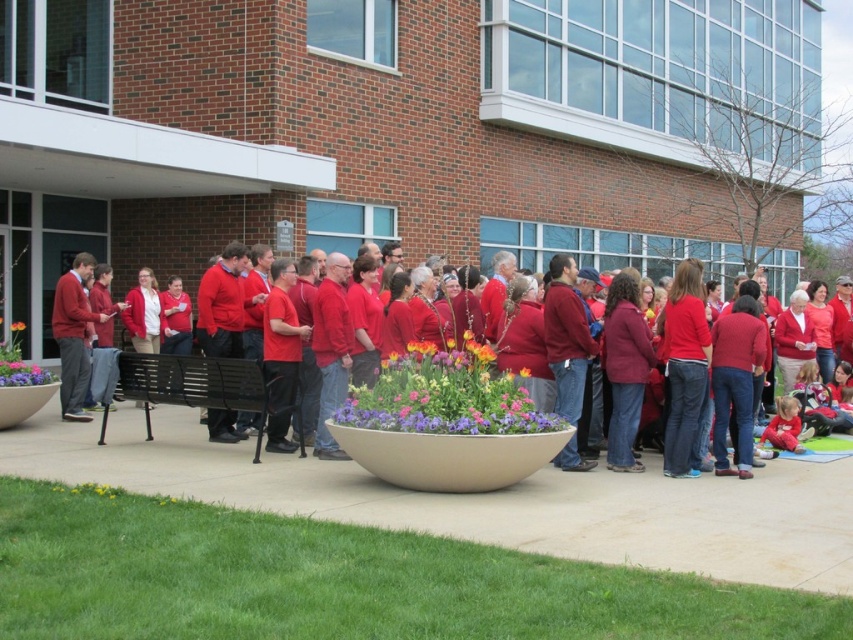
Question: Estimate the real-world distances between objects in this image. Which object is farther from the orange matte flower at center?

Choices:
 (A) matte red sweater at left
 (B) matte ceramic pot at lower left
 (C) black metal bench at lower left
 (D) matte red sweater at center

Answer: (D)

Question: Can you confirm if matte red sweater at center is positioned above orange matte flower at center?

Choices:
 (A) yes
 (B) no

Answer: (A)

Question: Estimate the real-world distances between objects in this image. Which object is farther from the vibrant floral bouquet at center?

Choices:
 (A) matte red sweater at left
 (B) matte red sweater at center
 (C) matte ceramic pot at lower left
 (D) orange matte flower at center

Answer: (D)

Question: Can you confirm if vibrant floral bouquet at center is positioned above orange matte flower at center?

Choices:
 (A) no
 (B) yes

Answer: (A)

Question: Can you confirm if matte red sweater at left is positioned to the right of orange matte flower at center?

Choices:
 (A) yes
 (B) no

Answer: (A)

Question: Which point is farther to the camera?

Choices:
 (A) (22, 328)
 (B) (78, 291)
 (C) (432, 388)
 (D) (235, 403)

Answer: (A)